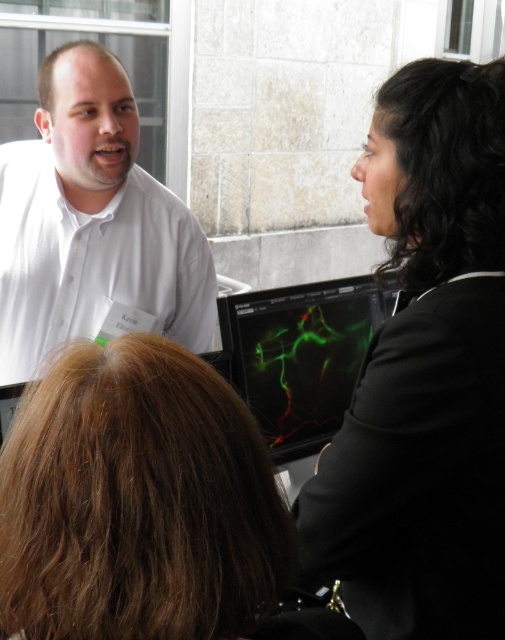
You are a researcher in the lab and need to present your findings to the team. You see the brown hair at center and the green matte screen at center. Which object is narrower?

The brown hair at center is narrower than the green matte screen at center.

You are standing at the origin point of the coordinate system. You want to move towards the black smooth suit at right. Which direction should you move in?

You should move towards the direction of the point with coordinates approximately 0.584 in the x axis and 0.844 in the y axis to reach the black smooth suit at right.